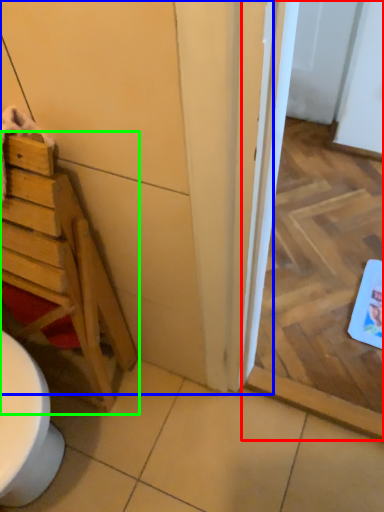
Question: Which object is the closest to the screen door (highlighted by a red box)? Choose among these: door (highlighted by a blue box) or furniture (highlighted by a green box).

Choices:
 (A) door
 (B) furniture

Answer: (A)